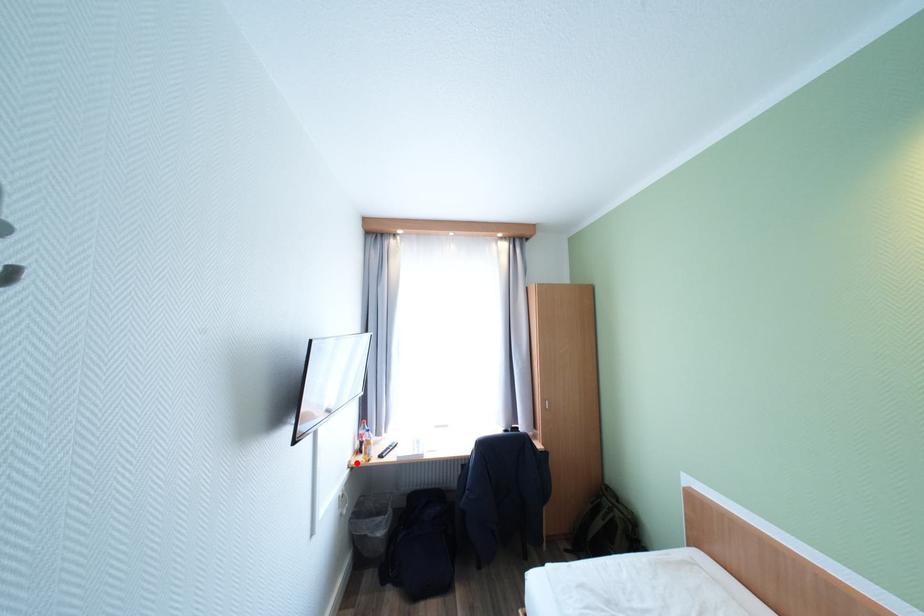
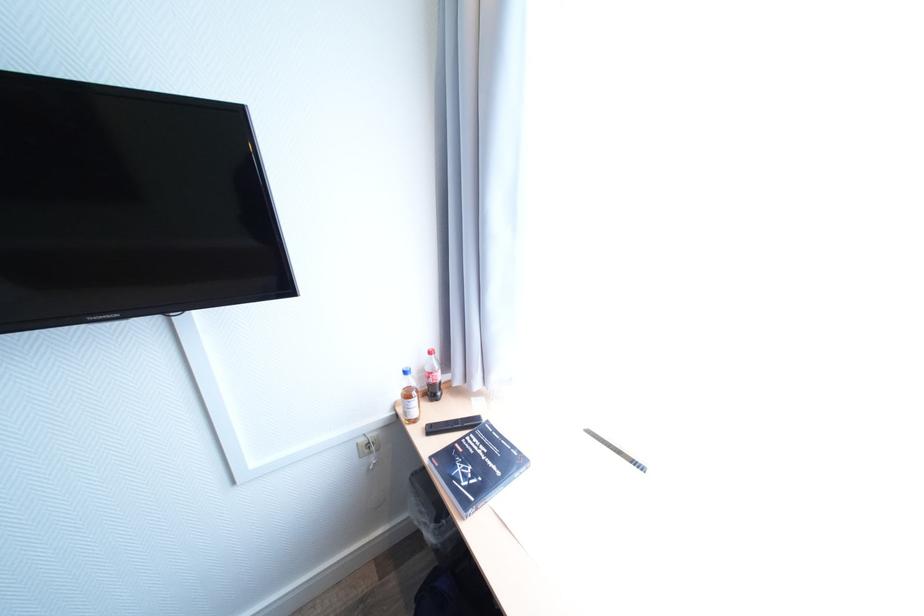
Find the pixel in the second image that matches the highlighted location in the first image.

(403, 403)